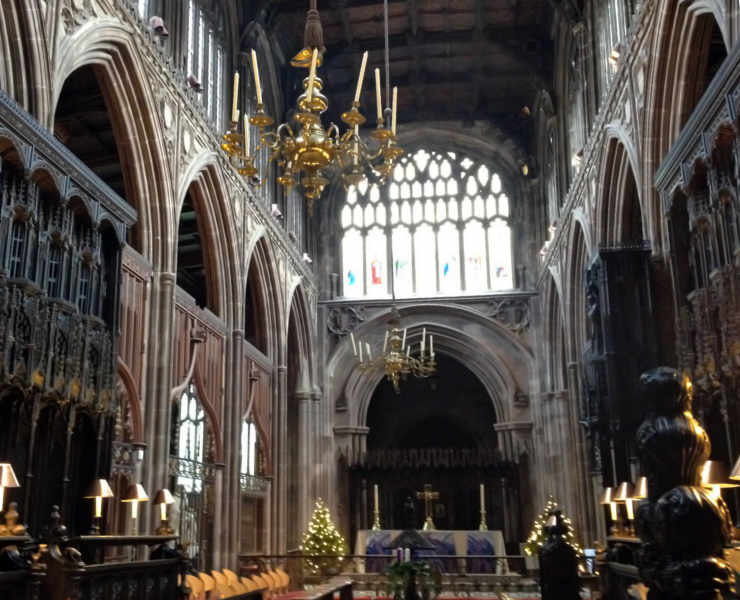
Locate an element on the screen. The width and height of the screenshot is (740, 600). windows is located at coordinates (357, 246), (371, 247), (403, 252), (428, 256), (448, 252), (473, 255), (500, 255).